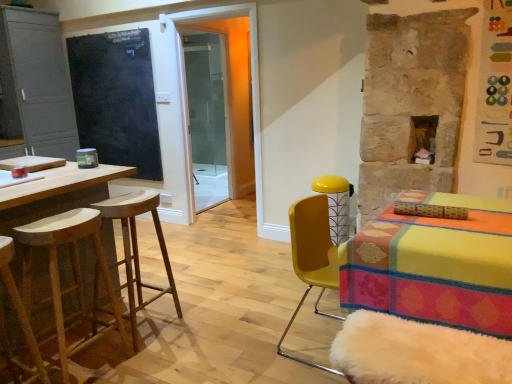
Question: Is matte gray cabinet at left beside yellow matte chair at right?

Choices:
 (A) no
 (B) yes

Answer: (A)

Question: Is matte gray cabinet at left to the right of yellow matte chair at right from the viewer's perspective?

Choices:
 (A) no
 (B) yes

Answer: (A)

Question: From the image's perspective, is matte gray cabinet at left on top of yellow matte chair at right?

Choices:
 (A) yes
 (B) no

Answer: (A)

Question: Does matte gray cabinet at left come in front of yellow matte chair at right?

Choices:
 (A) yes
 (B) no

Answer: (B)

Question: Would you say matte gray cabinet at left contains yellow matte chair at right?

Choices:
 (A) no
 (B) yes

Answer: (A)

Question: Considering the relative sizes of matte gray cabinet at left and yellow matte chair at right in the image provided, is matte gray cabinet at left shorter than yellow matte chair at right?

Choices:
 (A) yes
 (B) no

Answer: (B)

Question: From a real-world perspective, is natural wood stool at left, the second stool viewed from the front, physically below transparent glass shower door at center?

Choices:
 (A) yes
 (B) no

Answer: (A)

Question: Considering the relative sizes of natural wood stool at left, the second stool from the back, and transparent glass shower door at center in the image provided, is natural wood stool at left, the second stool from the back, smaller than transparent glass shower door at center?

Choices:
 (A) yes
 (B) no

Answer: (A)

Question: Considering the relative sizes of natural wood stool at left, the second stool from the back, and transparent glass shower door at center in the image provided, is natural wood stool at left, the second stool from the back, thinner than transparent glass shower door at center?

Choices:
 (A) no
 (B) yes

Answer: (A)

Question: Is natural wood stool at left, the second stool viewed from the front, facing away from transparent glass shower door at center?

Choices:
 (A) yes
 (B) no

Answer: (B)

Question: Is natural wood stool at left, the second stool from the back, shorter than transparent glass shower door at center?

Choices:
 (A) no
 (B) yes

Answer: (B)

Question: Is natural wood stool at left, the second stool from the back, not close to transparent glass shower door at center?

Choices:
 (A) no
 (B) yes

Answer: (B)

Question: From the image's perspective, is transparent glass shower door at center on natural wood stool at left, the second stool from the back?

Choices:
 (A) no
 (B) yes

Answer: (B)